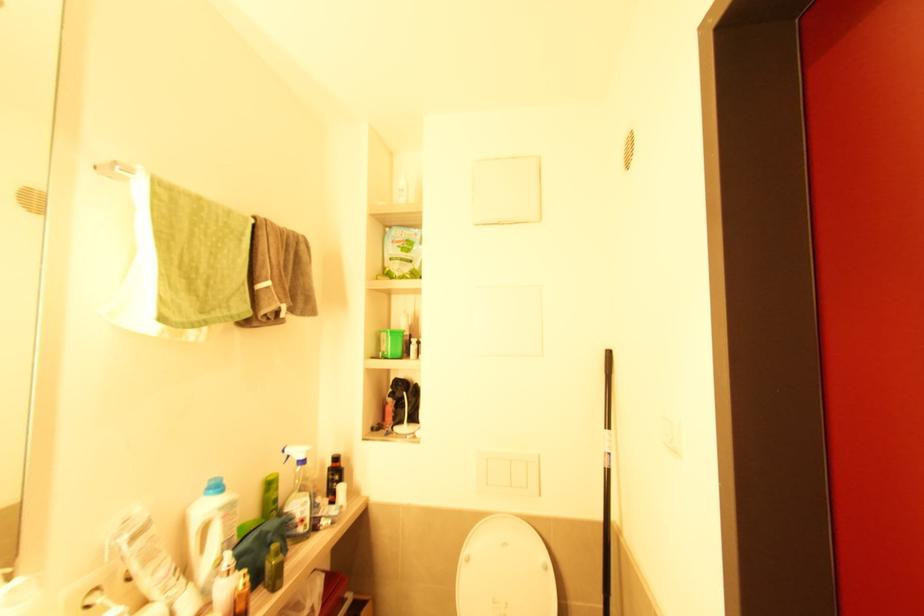
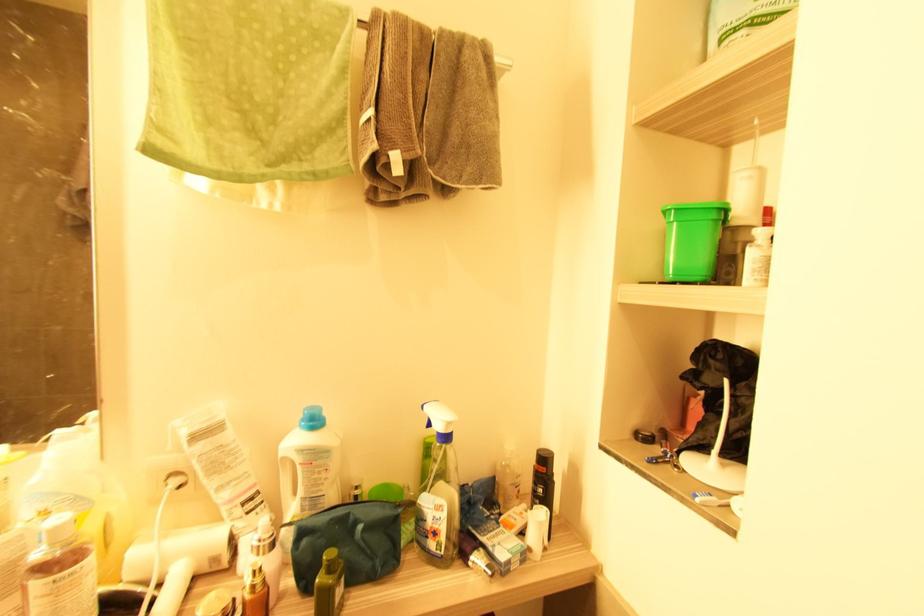
Find the pixel in the second image that matches pixel 339 464 in the first image.

(545, 469)